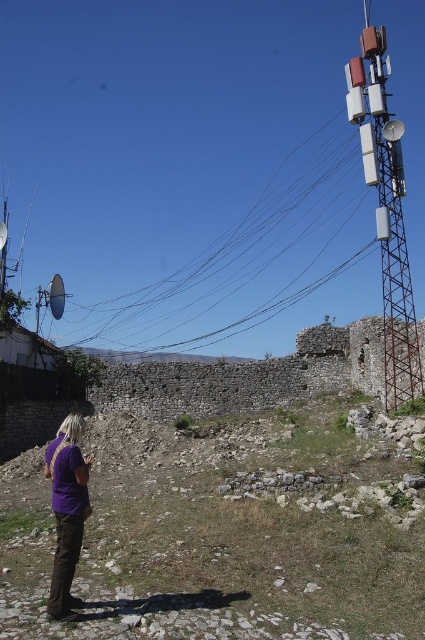
Question: Among these points, which one is farthest from the camera?

Choices:
 (A) (306, 410)
 (B) (289, 154)
 (C) (391, 381)
 (D) (81, 534)

Answer: (B)

Question: Does gravelly stone hillside at lower center appear over metallic gray tower at right?

Choices:
 (A) yes
 (B) no

Answer: (B)

Question: Which point is farther from the camera taking this photo?

Choices:
 (A) (59, 451)
 (B) (166, 344)
 (C) (8, 582)
 (D) (382, 33)

Answer: (B)

Question: Is gravelly stone hillside at lower center further to camera compared to metallic gray tower at right?

Choices:
 (A) yes
 (B) no

Answer: (B)

Question: Which of these objects is positioned farthest from the black wire at upper right?

Choices:
 (A) purple cotton shirt at lower left
 (B) metallic gray tower at right
 (C) gravelly stone hillside at lower center

Answer: (C)

Question: Is gravelly stone hillside at lower center behind black wire at upper right?

Choices:
 (A) no
 (B) yes

Answer: (A)